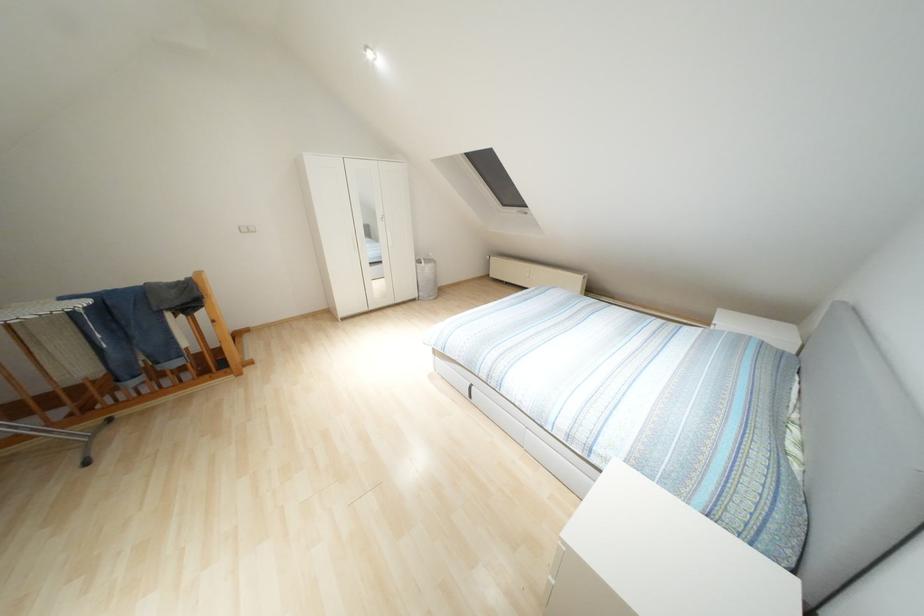
The width and height of the screenshot is (924, 616). What do you see at coordinates (393, 238) in the screenshot?
I see `the white wardrobe handle` at bounding box center [393, 238].